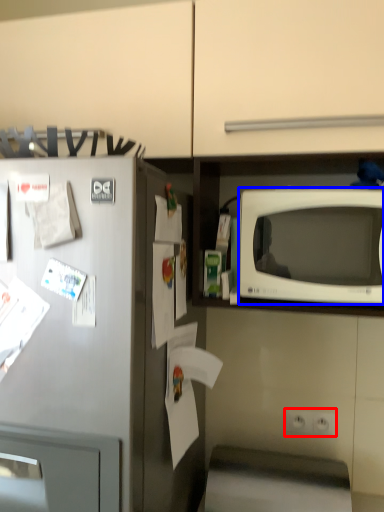
Question: Which object is further to the camera taking this photo, electric outlet (highlighted by a red box) or microwave oven (highlighted by a blue box)?

Choices:
 (A) electric outlet
 (B) microwave oven

Answer: (A)